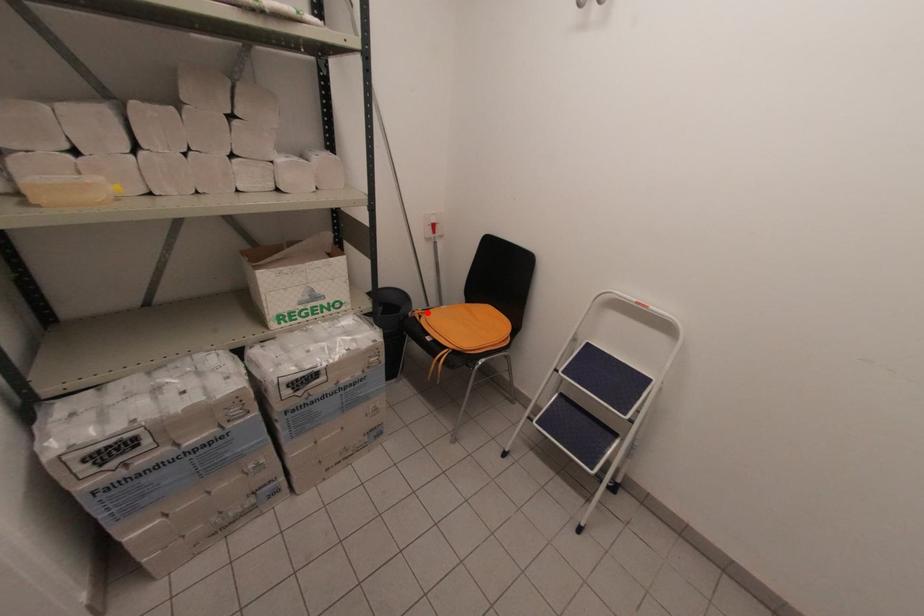
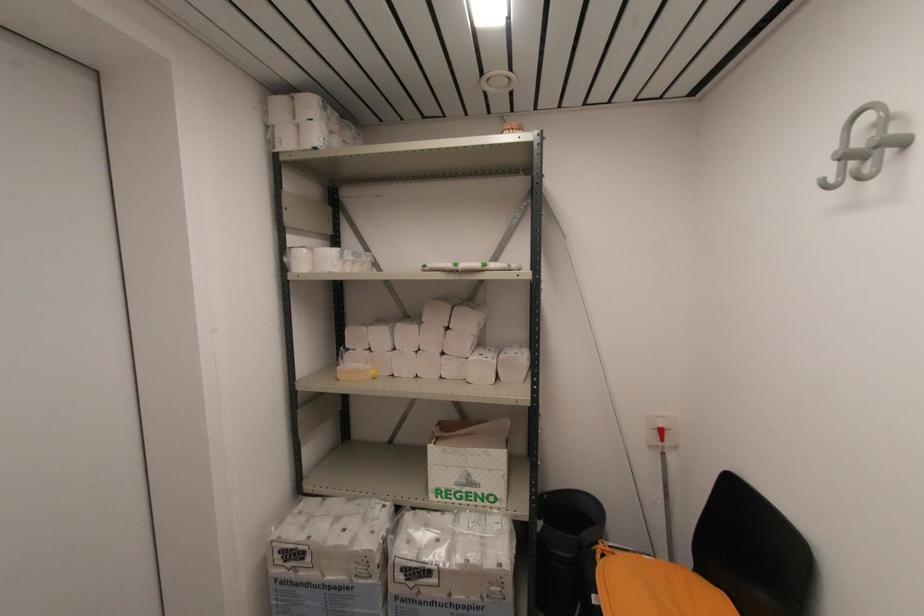
In the second image, find the point that corresponds to the highlighted location in the first image.

(614, 554)